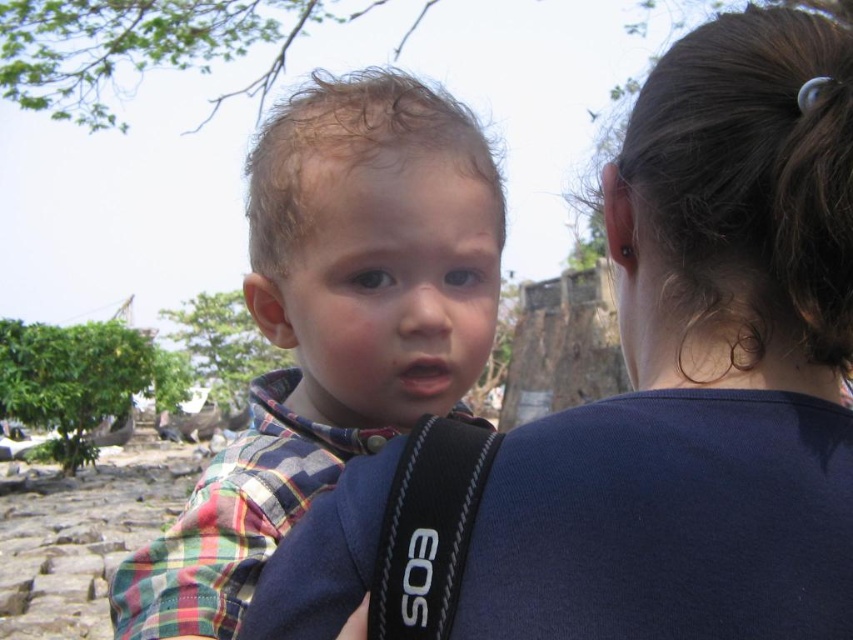
Who is shorter, blue fabric shirt at upper center or plaid shirt at center?

plaid shirt at center

Is blue fabric shirt at upper center shorter than plaid shirt at center?

No, blue fabric shirt at upper center is not shorter than plaid shirt at center.

Does point (758, 598) come closer to viewer compared to point (370, 125)?

Yes, it is.

Find the location of a particular element. The width and height of the screenshot is (853, 640). blue fabric shirt at upper center is located at coordinates [x=701, y=371].

Which is above, plaid shirt at center or black fabric strap at center?

plaid shirt at center is above.

Does plaid shirt at center appear over black fabric strap at center?

Correct, plaid shirt at center is located above black fabric strap at center.

What do you see at coordinates (334, 326) in the screenshot? The width and height of the screenshot is (853, 640). I see `plaid shirt at center` at bounding box center [334, 326].

Locate an element on the screen. plaid shirt at center is located at coordinates (334, 326).

Between point (604, 192) and point (409, 541), which one is positioned in front?

Point (409, 541) is in front.

Is point (682, 449) behind point (453, 541)?

Yes, it is.

Identify the location of blue fabric shirt at upper center. (701, 371).